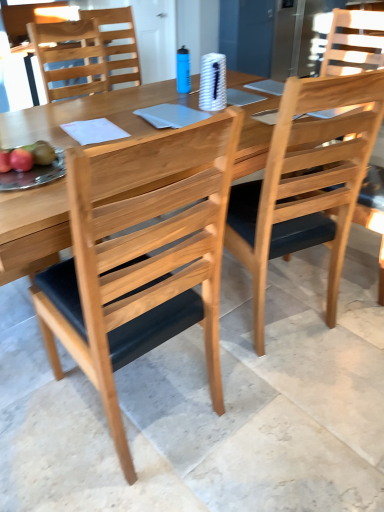
Find the location of a particular element. The image size is (384, 512). free spot to the right of light brown wood chair at center, acting as the second chair starting from the front is located at coordinates (343, 300).